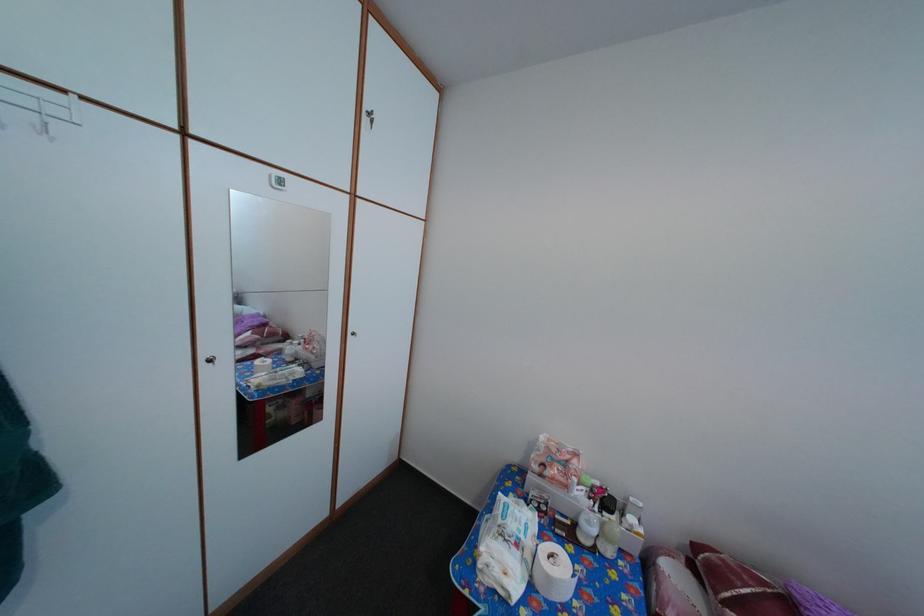
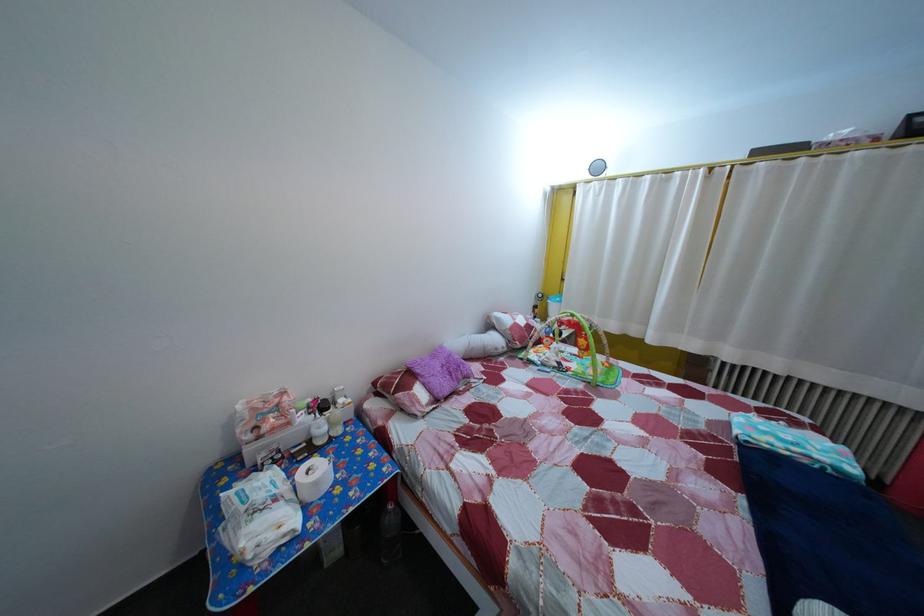
In the second image, find the point that corresponds to pixel 576 496 in the first image.

(298, 432)